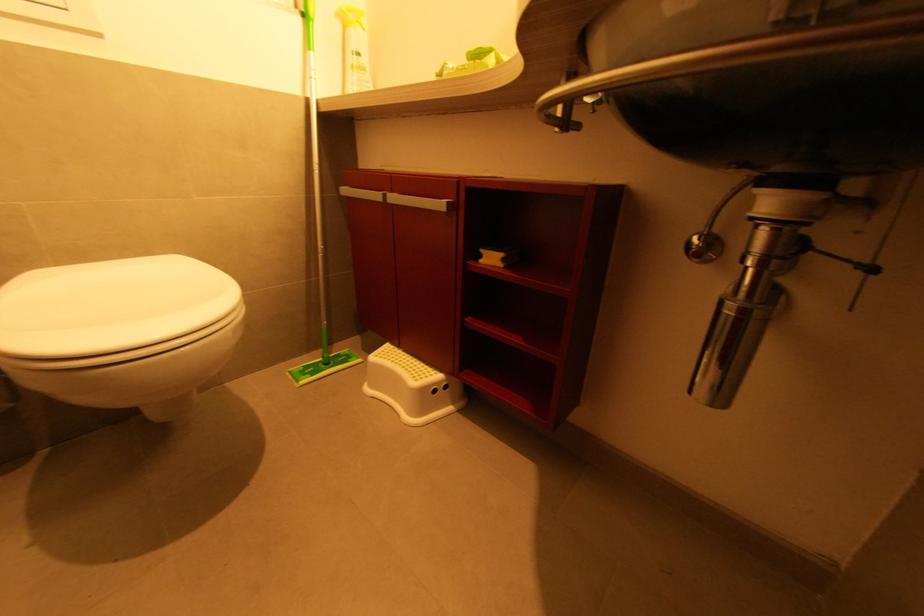
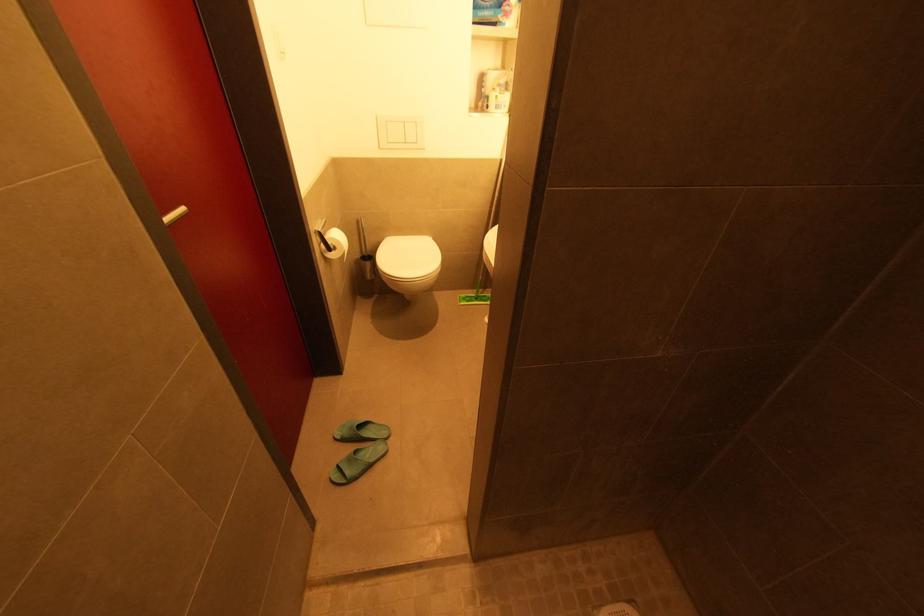
Question: The camera is either moving clockwise (left) or counter-clockwise (right) around the object. The first image is from the beginning of the video and the second image is from the end. Is the camera moving left or right when shooting the video?

Choices:
 (A) Left
 (B) Right

Answer: (B)